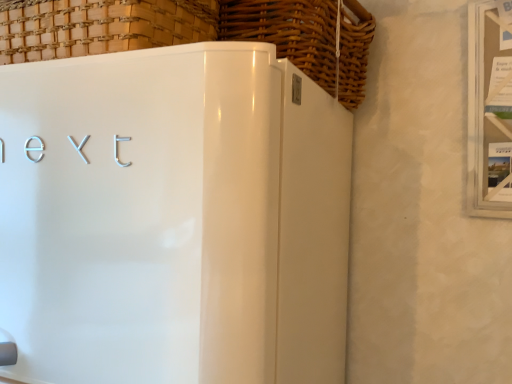
Question: From their relative heights in the image, would you say white glossy refrigerator at center is taller or shorter than woven wood basket at upper center, the 1th basket from the right?

Choices:
 (A) short
 (B) tall

Answer: (B)

Question: Considering their positions, is white glossy refrigerator at center located in front of or behind woven wood basket at upper center, the 1th basket from the right?

Choices:
 (A) behind
 (B) front

Answer: (B)

Question: Which object is the farthest from the woven wood basket at upper center, the 2th basket when ordered from left to right?

Choices:
 (A) woven wood basket at upper left, the 1th basket viewed from the left
 (B) white glossy refrigerator at center

Answer: (B)

Question: Estimate the real-world distances between objects in this image. Which object is farther from the woven wood basket at upper center, the 1th basket from the right?

Choices:
 (A) woven wood basket at upper left, the 1th basket viewed from the left
 (B) white glossy refrigerator at center

Answer: (B)